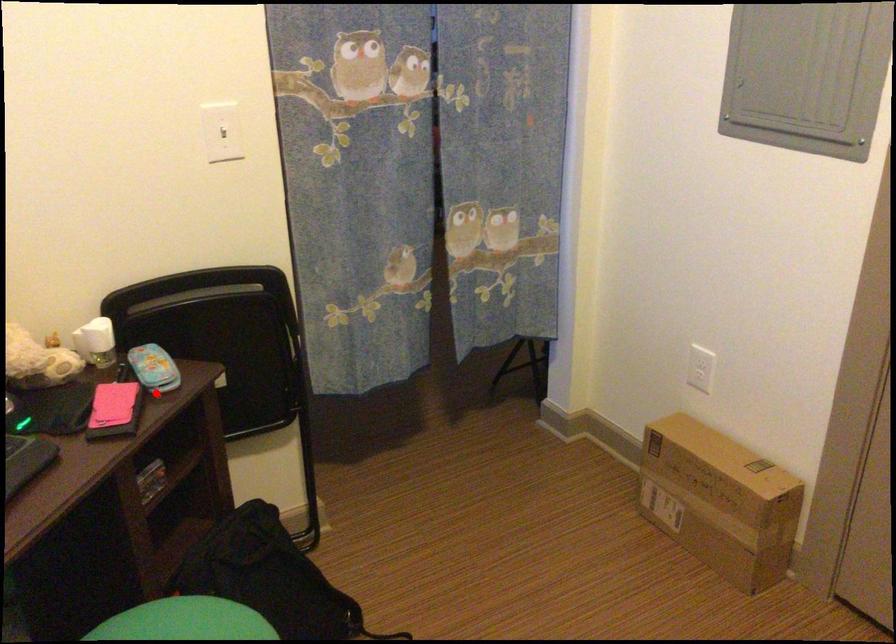
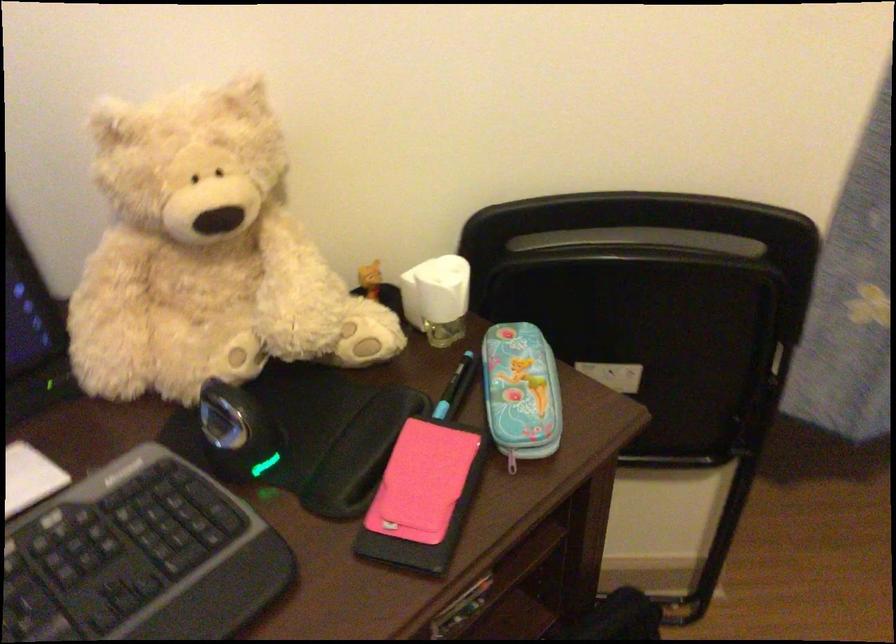
Find the pixel in the second image that matches the highlighted location in the first image.

(512, 460)